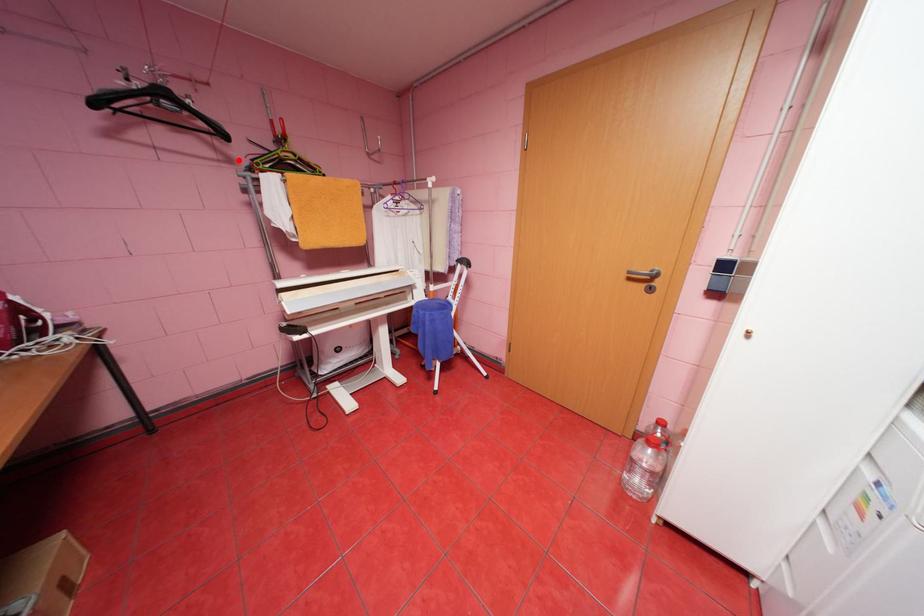
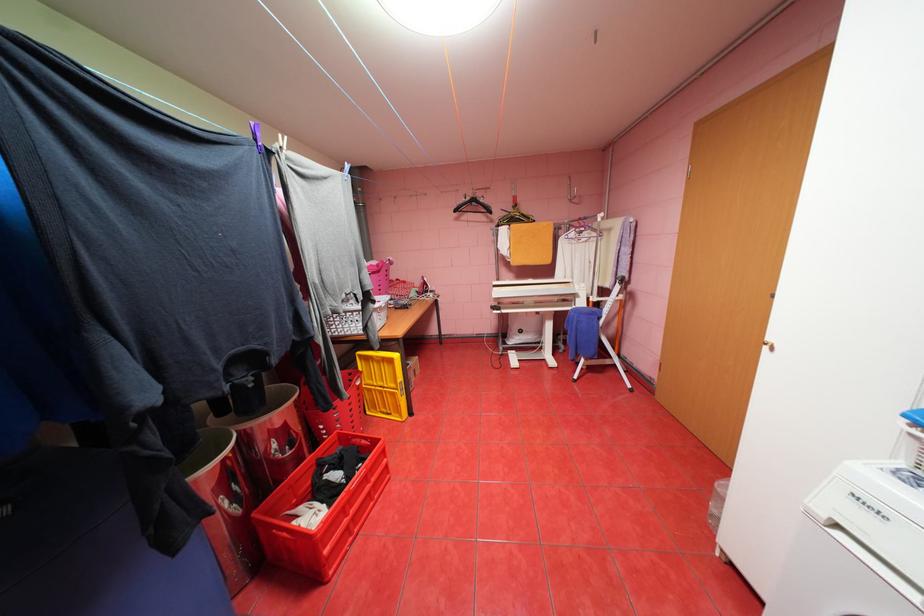
Question: I am providing you with two images of the same scene from different viewpoints. Image1 has a red point marked. In image2, the corresponding 3D location appears at what relative position? Reply with the corresponding letter.

Choices:
 (A) Closer
 (B) Farther

Answer: (A)